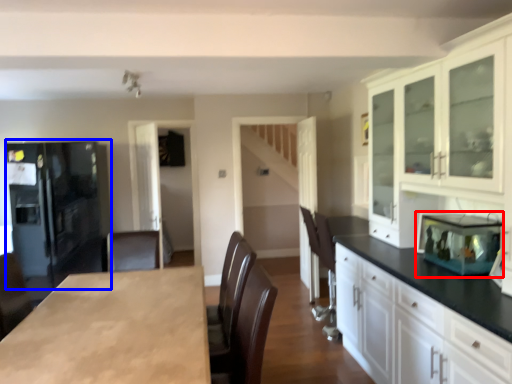
Question: Among these objects, which one is farthest to the camera, appliance (highlighted by a red box) or refrigerator (highlighted by a blue box)?

Choices:
 (A) appliance
 (B) refrigerator

Answer: (B)